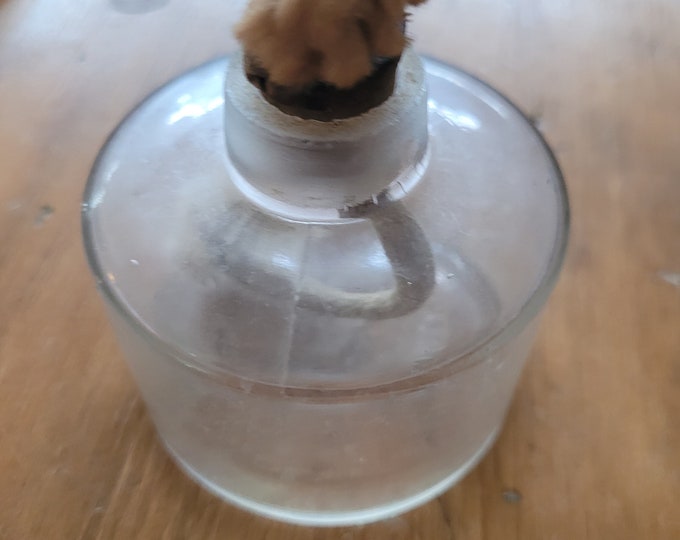
What are the coordinates of `glass` in the screenshot? It's located at (258, 315), (447, 294), (475, 182), (352, 467).